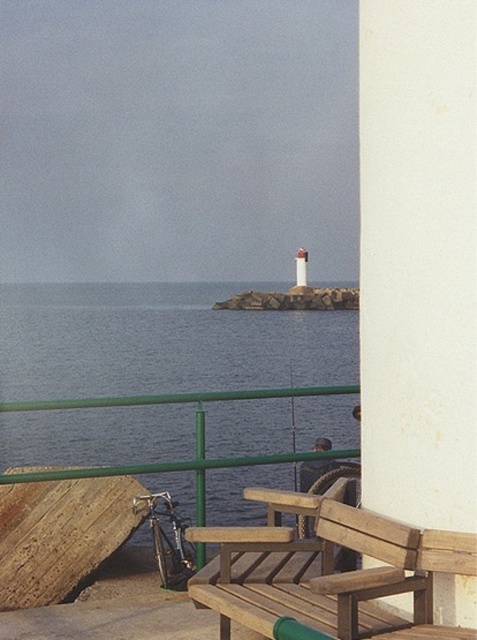
Question: Which point is farther to the camera?

Choices:
 (A) white matte lighthouse at center
 (B) blue water at center

Answer: (A)

Question: Which of these objects is positioned farthest from the white matte lighthouse at center?

Choices:
 (A) white smooth pillar at right
 (B) blue water at center
 (C) wooden bench at center

Answer: (A)

Question: Does white smooth pillar at right appear over wooden bench at center?

Choices:
 (A) yes
 (B) no

Answer: (A)

Question: Can you confirm if white smooth pillar at right is bigger than white matte lighthouse at center?

Choices:
 (A) yes
 (B) no

Answer: (B)

Question: Which object is closer to the camera taking this photo?

Choices:
 (A) wooden bench at center
 (B) white smooth pillar at right

Answer: (A)

Question: Can you confirm if blue water at center is thinner than white matte lighthouse at center?

Choices:
 (A) no
 (B) yes

Answer: (A)